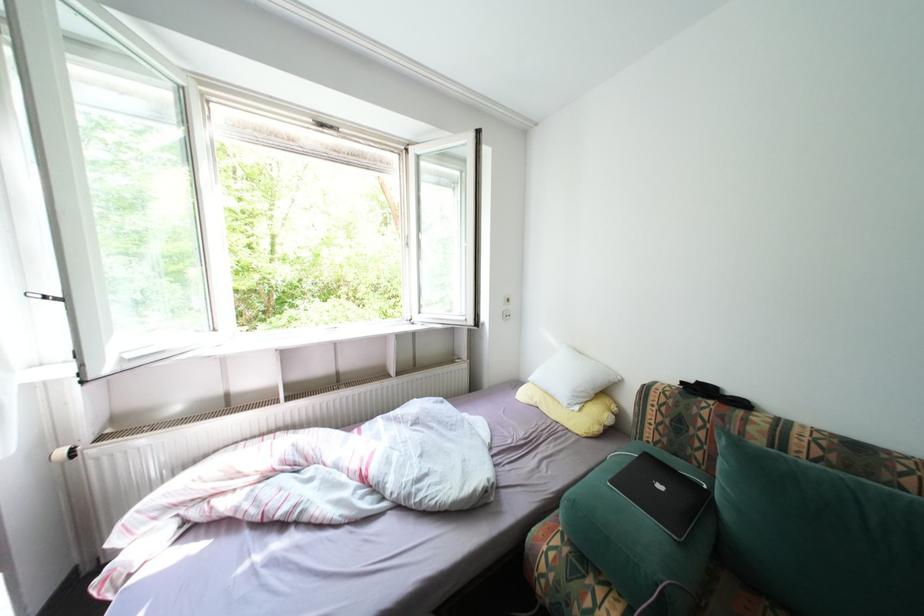
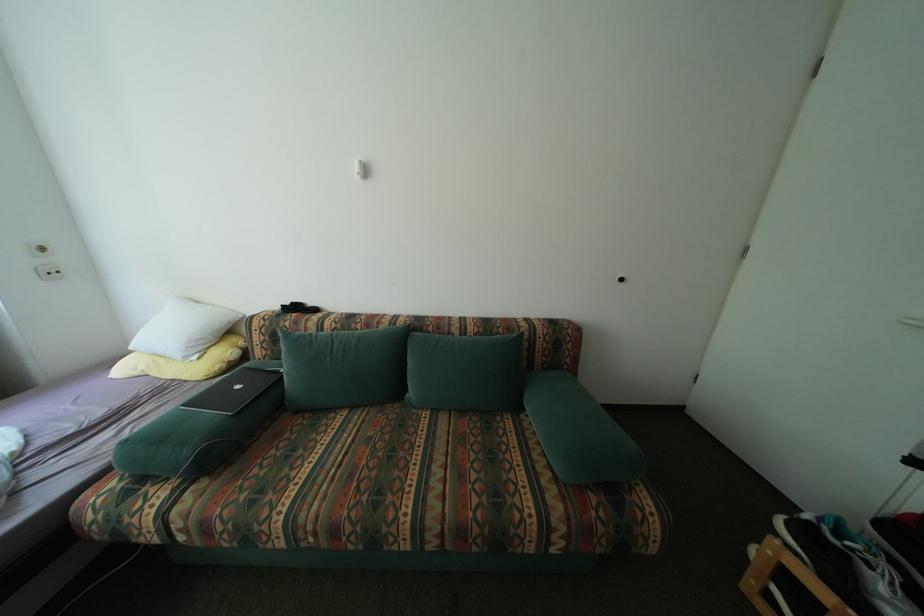
Question: How did the camera likely rotate?

Choices:
 (A) Left
 (B) Right
 (C) Up
 (D) Down

Answer: (B)